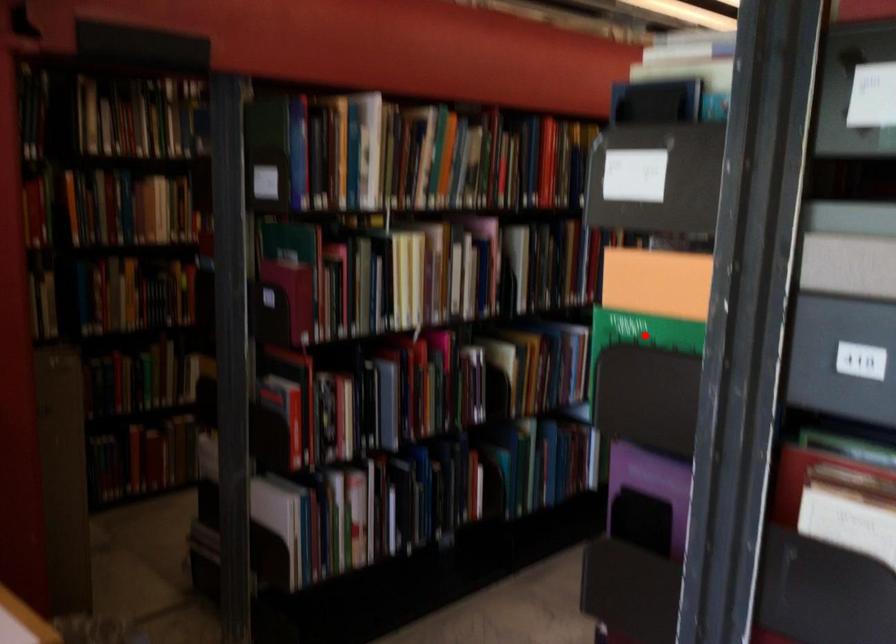
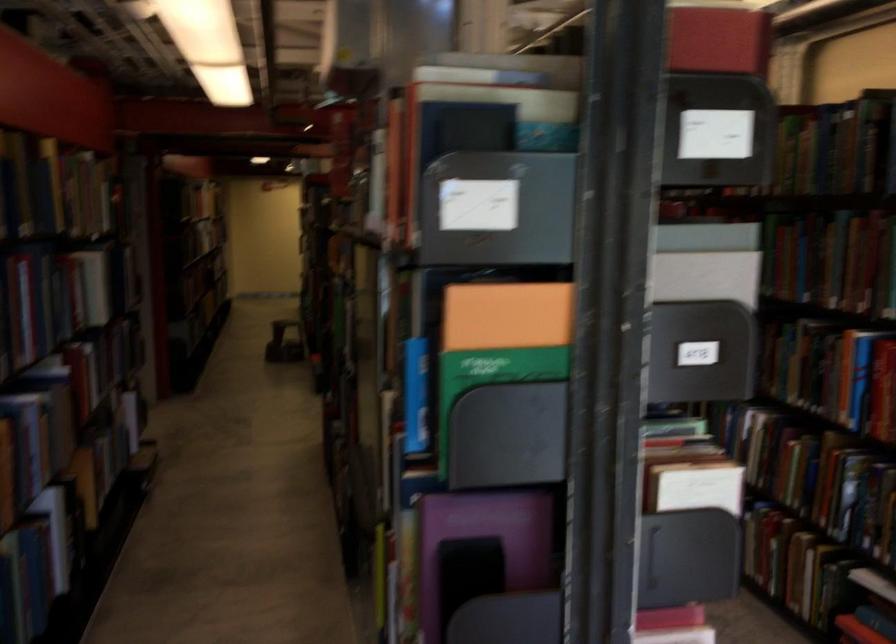
Where in the second image is the point corresponding to the highlighted location from the first image?

(490, 379)